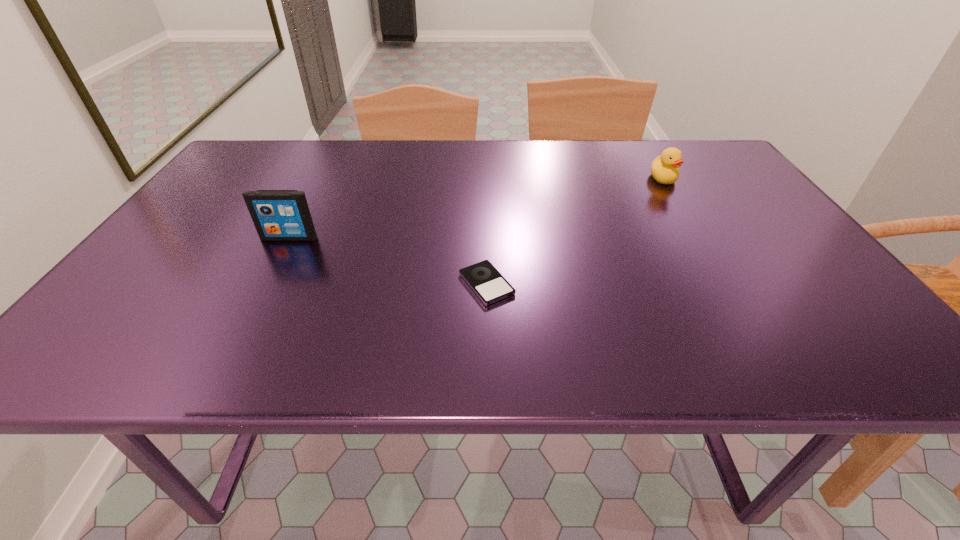
Locate an element on the screen. The width and height of the screenshot is (960, 540). vacant space at the far edge of the desktop is located at coordinates (426, 172).

The image size is (960, 540). In the image, there is a desktop. Identify the location of blank space at the near edge. (756, 366).

This screenshot has width=960, height=540. What are the coordinates of `vacant region at the left edge` in the screenshot? It's located at (111, 306).

Image resolution: width=960 pixels, height=540 pixels. I want to click on vacant space at the right edge of the desktop, so click(x=788, y=240).

Identify the location of free space at the far left corner of the desktop. (283, 141).

Image resolution: width=960 pixels, height=540 pixels. Find the location of `blank space at the far right corner`. blank space at the far right corner is located at coordinates (705, 166).

The height and width of the screenshot is (540, 960). In order to click on vacant space that is in between the farthest object and the left iPod in this screenshot , I will do `click(476, 208)`.

Find the location of a particular element. This screenshot has width=960, height=540. vacant area that lies between the rightmost object and the taller iPod is located at coordinates (476, 208).

In order to click on free space between the shortest object and the second tallest object in this screenshot , I will do `click(575, 231)`.

Find the location of `free area in between the farthest object and the taller iPod`. free area in between the farthest object and the taller iPod is located at coordinates (476, 208).